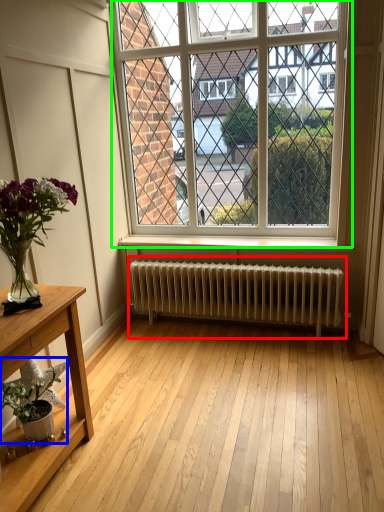
Question: Which object is positioned closest to radiator (highlighted by a red box)? Select from houseplant (highlighted by a blue box) and window (highlighted by a green box).

Choices:
 (A) houseplant
 (B) window

Answer: (B)